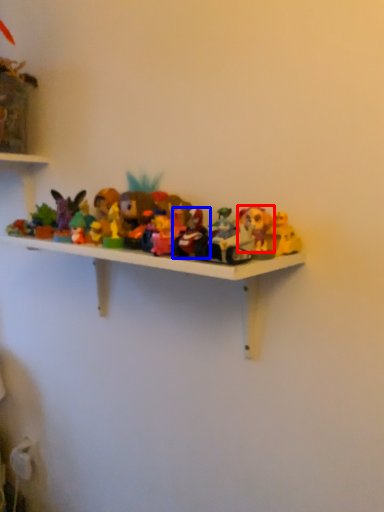
Question: Which object appears farthest to the camera in this image, toy (highlighted by a red box) or toy (highlighted by a blue box)?

Choices:
 (A) toy
 (B) toy

Answer: (A)